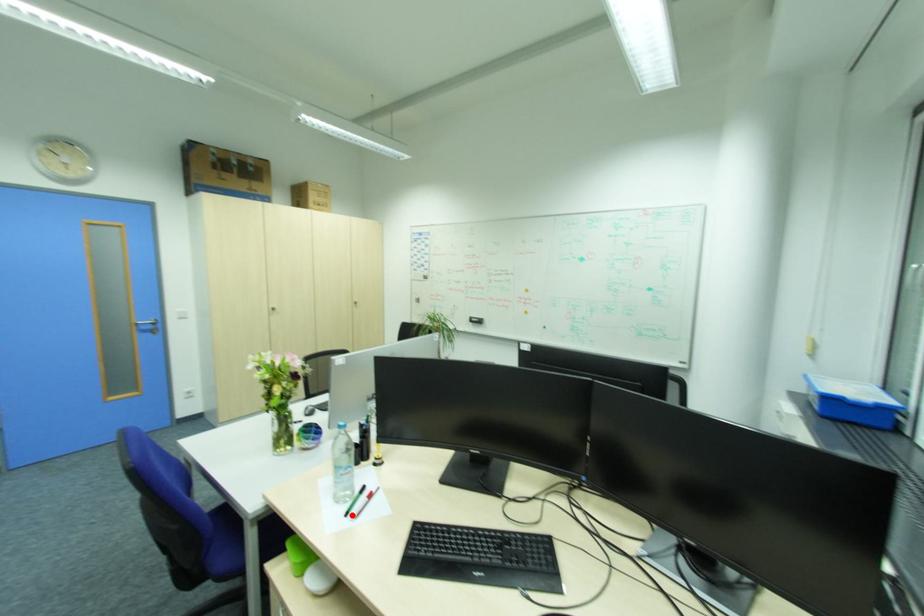
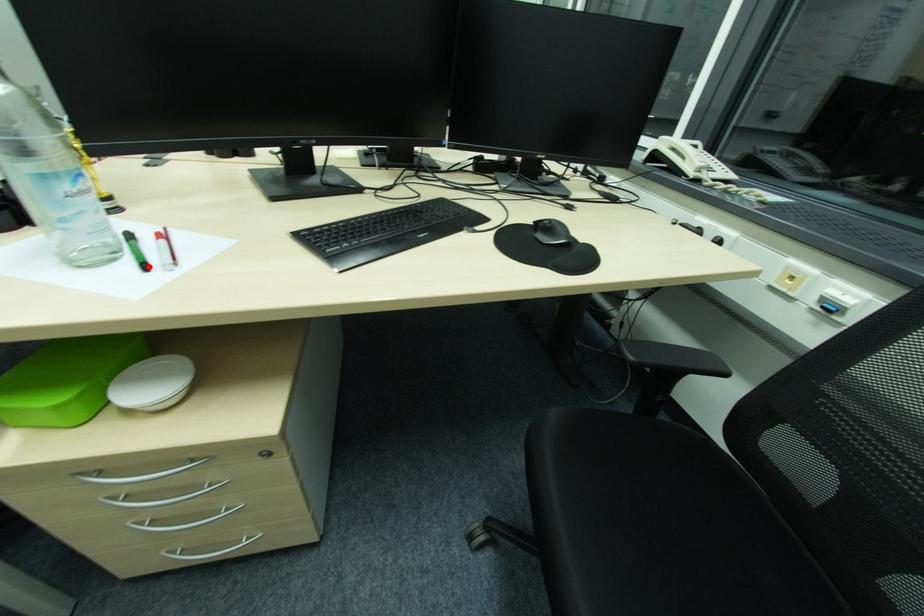
I am providing you with two images of the same scene from different viewpoints. A red point is marked on the first image and another point is marked on the second image. Is the red point in image1 aligned with the point shown in image2?

Yes